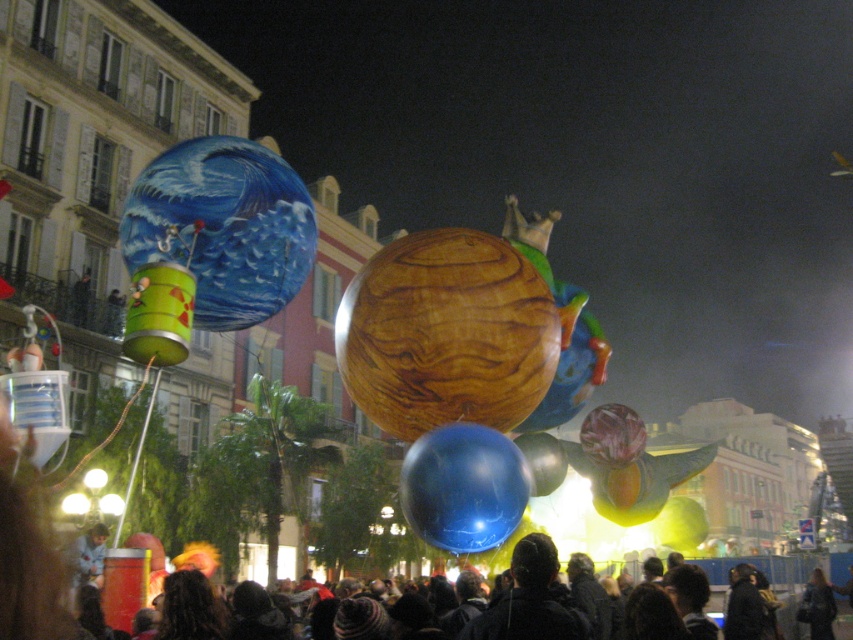
Which of these two, shiny metallic balloon at upper left or glossy blue balloon at center, stands taller?

With more height is shiny metallic balloon at upper left.

Where is `shiny metallic balloon at upper left`? The height and width of the screenshot is (640, 853). shiny metallic balloon at upper left is located at coordinates (223, 227).

Identify the location of shiny metallic balloon at upper left. (223, 227).

Does wooden sphere at center appear on the right side of dark hair at lower center?

No, wooden sphere at center is not to the right of dark hair at lower center.

Which is below, wooden sphere at center or dark hair at lower center?

Positioned lower is dark hair at lower center.

The height and width of the screenshot is (640, 853). In order to click on wooden sphere at center in this screenshot , I will do `click(448, 333)`.

Find the location of a particular element. The image size is (853, 640). wooden sphere at center is located at coordinates (448, 333).

Is point (416, 321) positioned before point (213, 321)?

That is True.

Locate an element on the screen. Image resolution: width=853 pixels, height=640 pixels. wooden sphere at center is located at coordinates (448, 333).